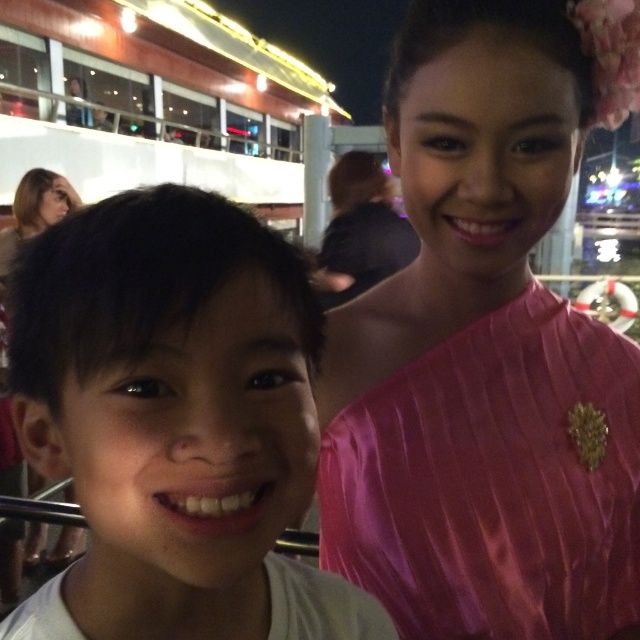
Where is the white matte shirt at center located in the image?

The white matte shirt at center is located at point coordinates of (x=173, y=422).

In the nighttime gathering scene, there is a young boy with short dark hair wearing a white shirt and a woman in a vibrant pink striped outfit with a brooch. Where is the white matte shirt at center located relative to the point at coordinates (173, 422)?

The point at coordinates (173, 422) corresponds exactly to the location of the white matte shirt at center, as stated in the Objects Description.